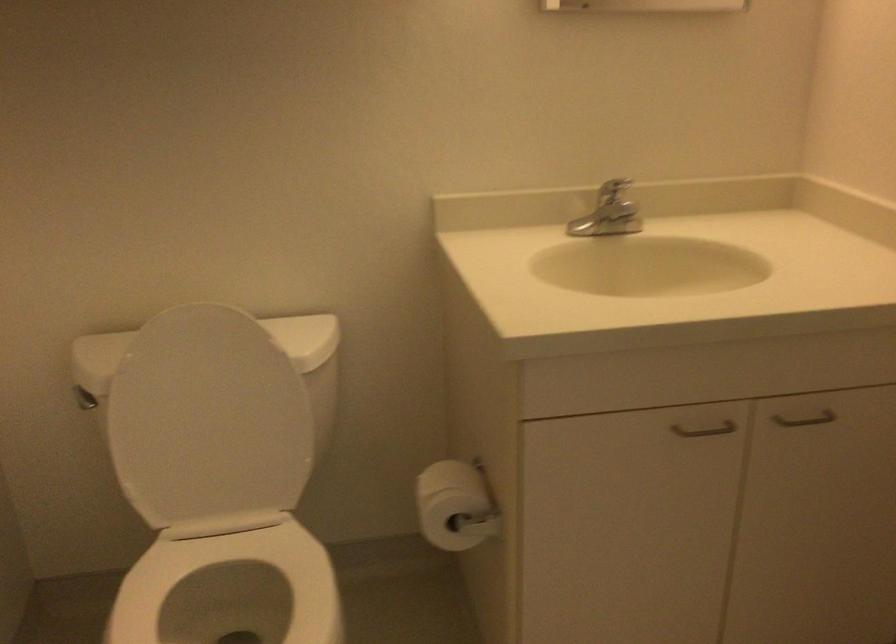
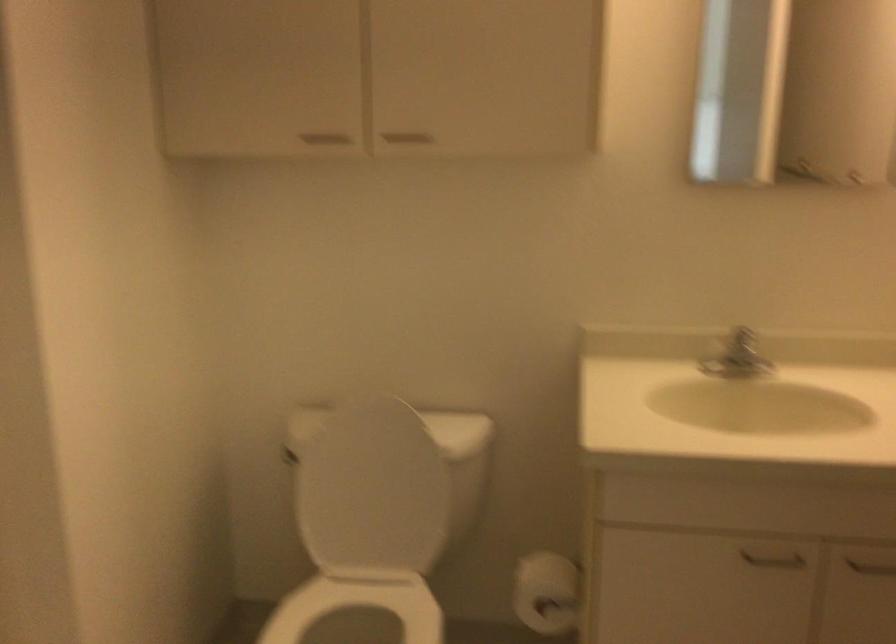
The point at (x=212, y=565) is marked in the first image. Where is the corresponding point in the second image?

(357, 605)